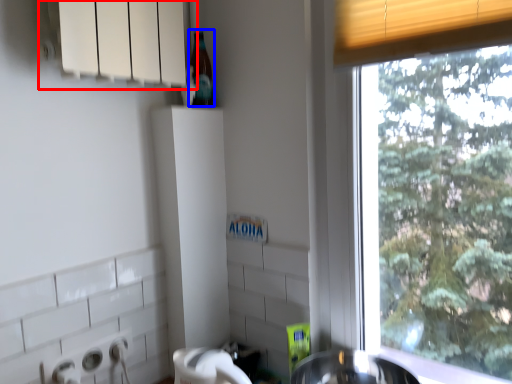
Question: Among these objects, which one is nearest to the camera, window sill (highlighted by a red box) or bottle (highlighted by a blue box)?

Choices:
 (A) window sill
 (B) bottle

Answer: (A)